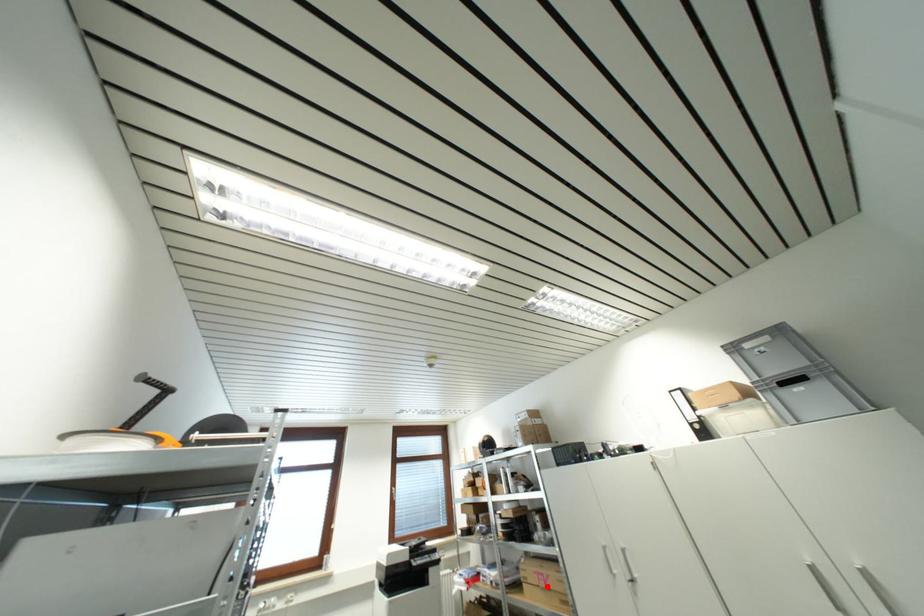
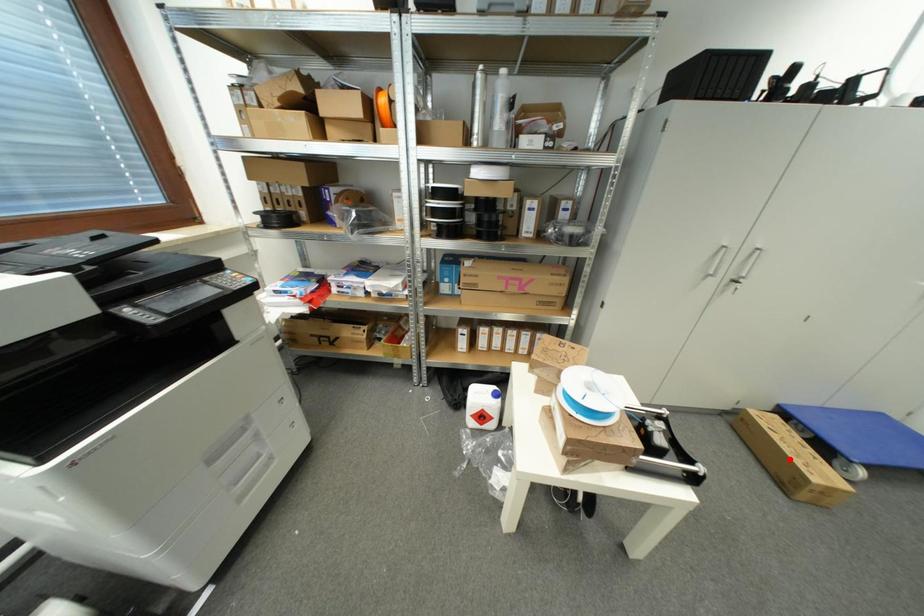
I am providing you with two images of the same scene from different viewpoints. A red point is marked on the first image and another point is marked on the second image. Is the red point in image1 aligned with the point shown in image2?

No